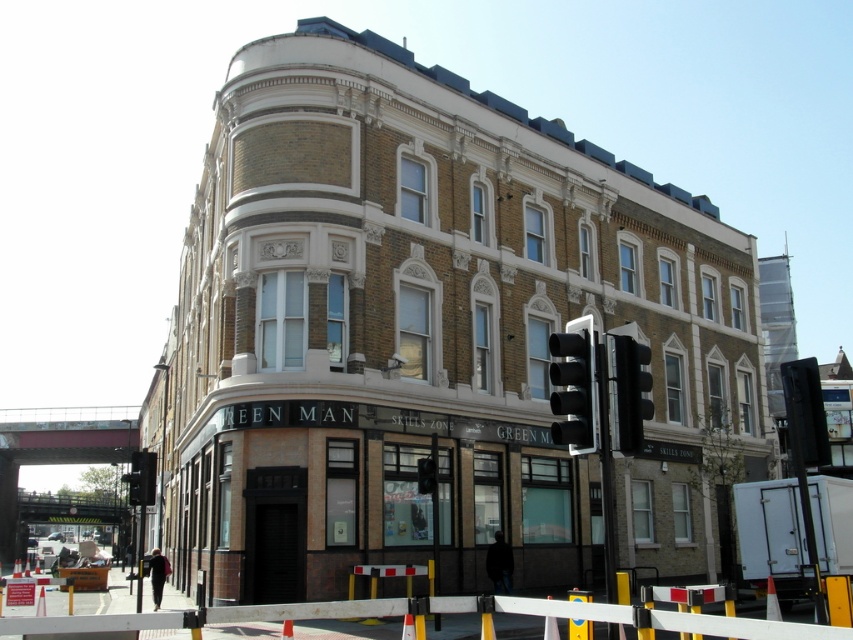
Does black glass traffic light at right have a lesser width compared to black plastic traffic light at upper right?

Incorrect, black glass traffic light at right's width is not less than black plastic traffic light at upper right's.

Is black glass traffic light at right wider than black plastic traffic light at upper right?

Yes, black glass traffic light at right is wider than black plastic traffic light at upper right.

Who is more distant from viewer, (570, 445) or (624, 378)?

The point (624, 378) is more distant.

Image resolution: width=853 pixels, height=640 pixels. I want to click on black glass traffic light at right, so point(575,385).

Locate an element on the screen. The image size is (853, 640). black plastic traffic light at right is located at coordinates (804, 413).

Locate an element on the screen. The image size is (853, 640). black plastic traffic light at right is located at coordinates (804, 413).

Where is `black glass traffic light at right`? This screenshot has height=640, width=853. black glass traffic light at right is located at coordinates (575, 385).

Based on the photo, can you confirm if black glass traffic light at right is positioned to the left of black plastic traffic light at right?

Yes, black glass traffic light at right is to the left of black plastic traffic light at right.

Is point (579, 376) farther from camera compared to point (798, 380)?

No, it is in front of (798, 380).

What are the coordinates of `black glass traffic light at right` in the screenshot? It's located at (575, 385).